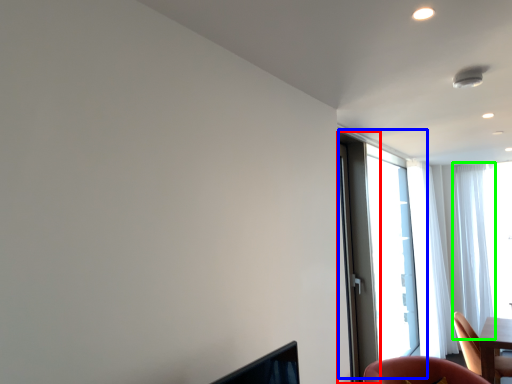
Question: Which object is positioned farthest from screen door (highlighted by a red box)? Select from window (highlighted by a blue box) and curtain (highlighted by a green box).

Choices:
 (A) window
 (B) curtain

Answer: (B)